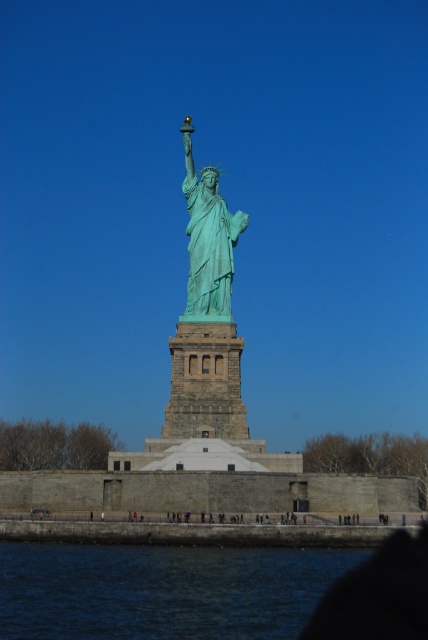
Is blue liquid water at lower left below green patina statue at center?

Yes, blue liquid water at lower left is below green patina statue at center.

Does blue liquid water at lower left come behind green patina statue at center?

That is False.

What do you see at coordinates (162, 589) in the screenshot? I see `blue liquid water at lower left` at bounding box center [162, 589].

Identify the location of blue liquid water at lower left. (162, 589).